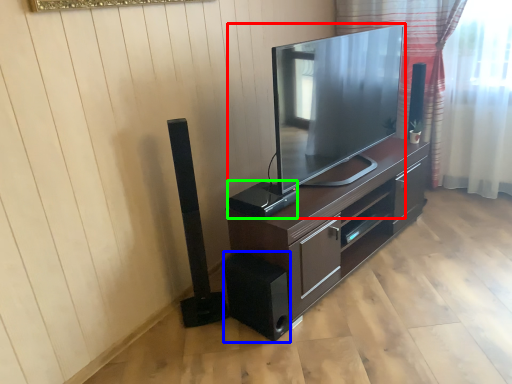
Question: Which is nearer to the television (highlighted by a red box)? speaker (highlighted by a blue box) or speaker (highlighted by a green box).

Choices:
 (A) speaker
 (B) speaker

Answer: (B)